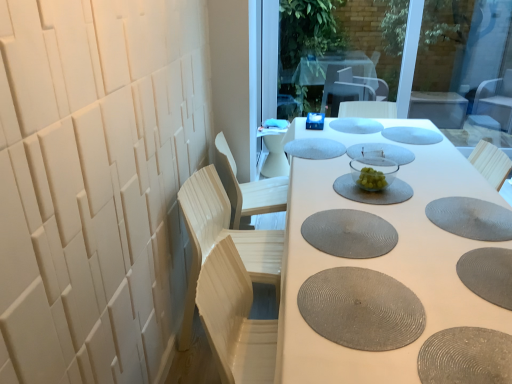
Identify the location of blank space situated above light blue fabric cushion at center, the third manhole cover when ordered from back to front (from a real-world perspective). The width and height of the screenshot is (512, 384). (314, 144).